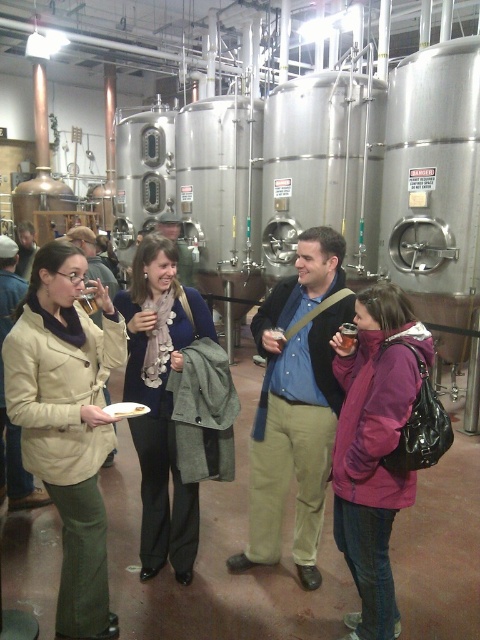
Is point (140, 266) more distant than point (363, 371)?

Yes, point (140, 266) is behind point (363, 371).

Does matte blue scarf at center have a greater height compared to purple fleece jacket at center?

Yes.

What do you see at coordinates (175, 404) in the screenshot? I see `matte blue scarf at center` at bounding box center [175, 404].

In order to click on matte blue scarf at center in this screenshot , I will do `click(175, 404)`.

Does matte beige coat at left have a lesser width compared to purple fleece jacket at center?

No.

In the scene shown: Is matte beige coat at left positioned behind purple fleece jacket at center?

Yes, matte beige coat at left is behind purple fleece jacket at center.

Who is more distant from viewer, (27,342) or (333,513)?

Positioned behind is point (333,513).

Identify the location of matte beige coat at left. (68, 420).

Consider the image. Is matte beige coat at left shorter than matte blue scarf at center?

Correct, matte beige coat at left is not as tall as matte blue scarf at center.

Is matte beige coat at left positioned behind matte blue scarf at center?

No, matte beige coat at left is in front of matte blue scarf at center.

What do you see at coordinates (68, 420) in the screenshot?
I see `matte beige coat at left` at bounding box center [68, 420].

Identify the location of matte beige coat at left. The height and width of the screenshot is (640, 480). (68, 420).